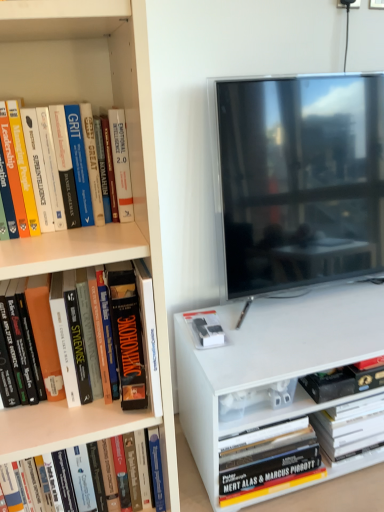
Question: From the image's perspective, is hardcover book at lower left, positioned as the 3th book in right-to-left order, below orange matte book at left, arranged as the fourth book when viewed from the back?

Choices:
 (A) yes
 (B) no

Answer: (A)

Question: Does hardcover book at lower left, marked as the 2th book in a left-to-right arrangement, lie in front of orange matte book at left, which is the 1th book in left-to-right order?

Choices:
 (A) yes
 (B) no

Answer: (B)

Question: Does hardcover book at lower left, positioned as the third book in back-to-front order, have a greater height compared to orange matte book at left, which ranks as the 1th book in front-to-back order?

Choices:
 (A) no
 (B) yes

Answer: (A)

Question: Is hardcover book at lower left, marked as the 2th book in a left-to-right arrangement, positioned with its back to orange matte book at left, placed as the fourth book when sorted from right to left?

Choices:
 (A) no
 (B) yes

Answer: (A)

Question: From a real-world perspective, is hardcover book at lower left, which appears as the 2th book when viewed from the front, positioned over orange matte book at left, arranged as the fourth book when viewed from the back, based on gravity?

Choices:
 (A) yes
 (B) no

Answer: (B)

Question: From a real-world perspective, is flat-screen tv at right positioned above or below hardcover book at lower right, the first book positioned from the right?

Choices:
 (A) above
 (B) below

Answer: (A)

Question: Looking at their shapes, would you say flat-screen tv at right is wider or thinner than hardcover book at lower right, the first book positioned from the right?

Choices:
 (A) wide
 (B) thin

Answer: (B)

Question: In the image, is flat-screen tv at right positioned in front of or behind hardcover book at lower right, which is counted as the fourth book, starting from the left?

Choices:
 (A) front
 (B) behind

Answer: (A)

Question: In terms of size, does flat-screen tv at right appear bigger or smaller than hardcover book at lower right, which is counted as the fourth book, starting from the left?

Choices:
 (A) small
 (B) big

Answer: (B)

Question: Is point (327, 236) positioned closer to the camera than point (127, 399)?

Choices:
 (A) farther
 (B) closer

Answer: (A)

Question: Is flat-screen tv at right situated inside orange matte book at left, which ranks as the 1th book in front-to-back order, or outside?

Choices:
 (A) outside
 (B) inside

Answer: (A)

Question: Relative to orange matte book at left, which is the 1th book in left-to-right order, is flat-screen tv at right in front or behind?

Choices:
 (A) behind
 (B) front

Answer: (A)

Question: In terms of width, does flat-screen tv at right look wider or thinner when compared to orange matte book at left, which ranks as the 1th book in front-to-back order?

Choices:
 (A) thin
 (B) wide

Answer: (A)

Question: Is black matte book at lower right, which is the second book from back to front, bigger or smaller than hardcover book at lower left, positioned as the 3th book in right-to-left order?

Choices:
 (A) big
 (B) small

Answer: (B)

Question: Is point (370, 371) positioned closer to the camera than point (150, 434)?

Choices:
 (A) farther
 (B) closer

Answer: (A)